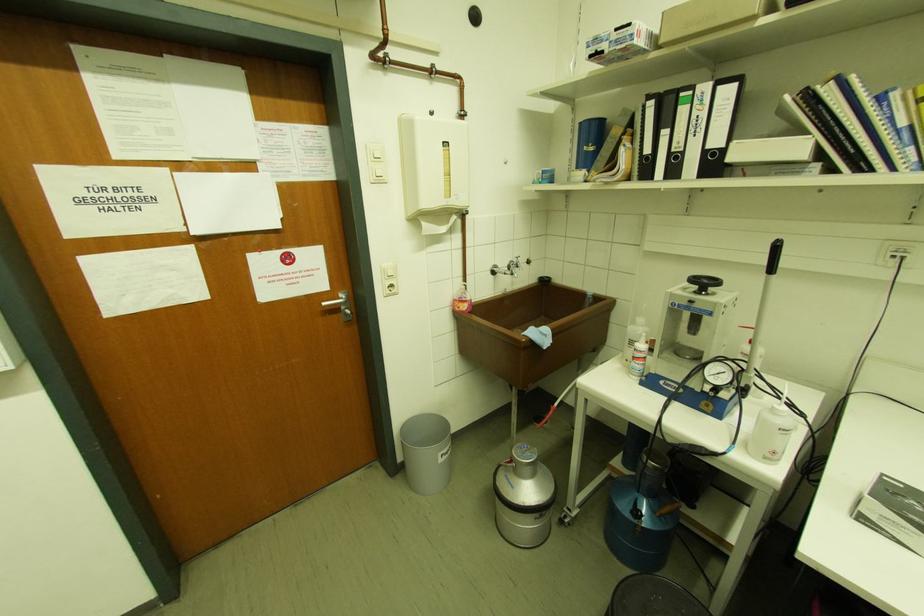
The height and width of the screenshot is (616, 924). In order to click on metal door handle in this screenshot , I will do `click(337, 302)`.